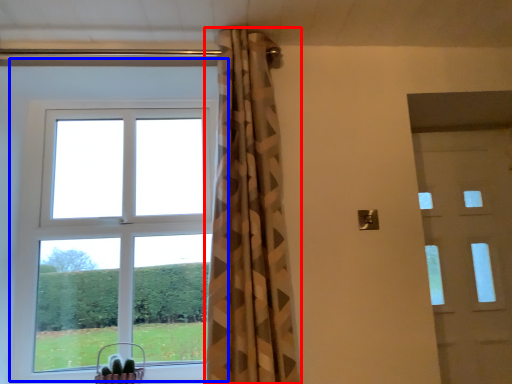
Question: Among these objects, which one is farthest to the camera, curtain (highlighted by a red box) or window (highlighted by a blue box)?

Choices:
 (A) curtain
 (B) window

Answer: (B)